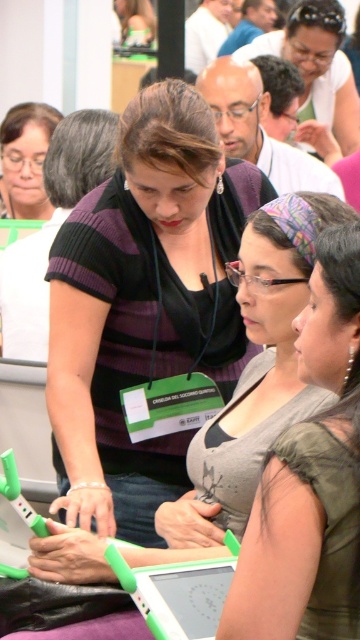
Question: Does gray matte tank top at center have a smaller size compared to green plastic laptop at center?

Choices:
 (A) no
 (B) yes

Answer: (A)

Question: Which object appears closest to the camera in this image?

Choices:
 (A) gray matte tank top at center
 (B) green plastic laptop at center

Answer: (A)

Question: Which of the following is the closest to the observer?

Choices:
 (A) (177, 324)
 (B) (213, 600)
 (C) (345, 576)
 (D) (267, 582)

Answer: (D)

Question: Which point is closer to the camera taking this photo?

Choices:
 (A) (138, 216)
 (B) (225, 544)

Answer: (B)

Question: Can you confirm if purple striped shirt at center is smaller than gray matte tank top at center?

Choices:
 (A) yes
 (B) no

Answer: (B)

Question: Can you confirm if purple striped shirt at center is smaller than green plastic laptop at center?

Choices:
 (A) yes
 (B) no

Answer: (B)